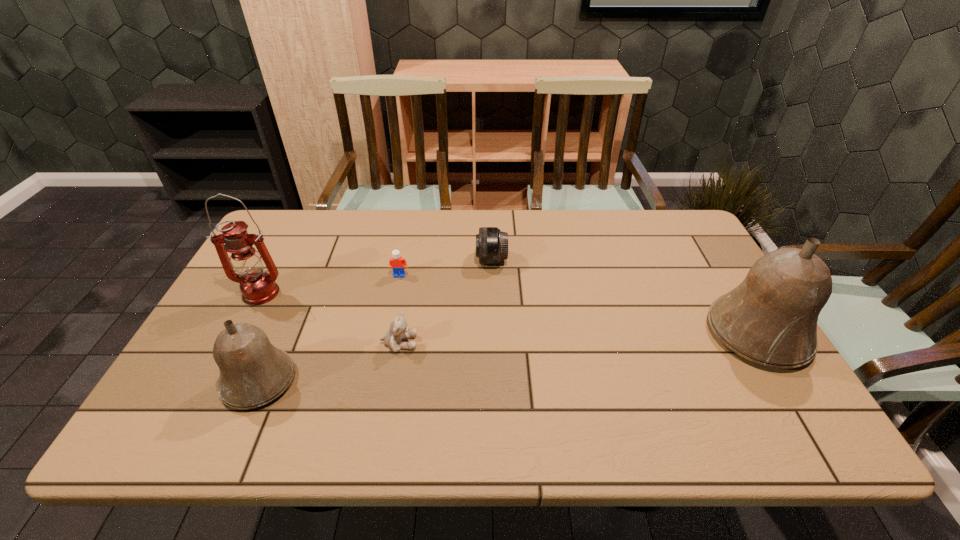
Locate an element on the screen. object located at the right edge is located at coordinates (770, 318).

The height and width of the screenshot is (540, 960). Identify the location of object that is at the near left corner. click(253, 372).

Where is `object that is positioned at the near right corner`? The height and width of the screenshot is (540, 960). object that is positioned at the near right corner is located at coordinates (770, 318).

In the image, there is a desktop. Identify the location of vacant space at the far edge. (622, 242).

At what (x,y) coordinates should I click in order to perform the action: click on vacant space at the near edge of the desktop. Please return your answer as a coordinate pair (x, y). The height and width of the screenshot is (540, 960). Looking at the image, I should click on (462, 380).

Where is `vacant space at the left edge`? vacant space at the left edge is located at coordinates (236, 322).

At what (x,y) coordinates should I click in order to perform the action: click on vacant space at the right edge. Please return your answer as a coordinate pair (x, y). Looking at the image, I should click on (722, 294).

Where is `vacant point at the near left corner`? This screenshot has width=960, height=540. vacant point at the near left corner is located at coordinates (184, 396).

Image resolution: width=960 pixels, height=540 pixels. In the image, there is a desktop. In order to click on vacant space at the far right corner in this screenshot , I will do 662,228.

The width and height of the screenshot is (960, 540). I want to click on vacant space at the near right corner, so click(723, 376).